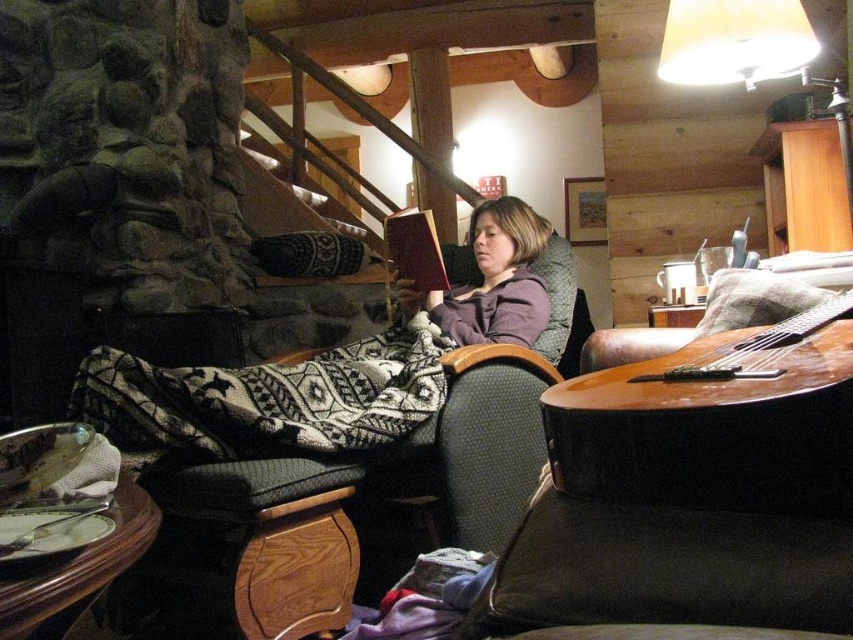
Between knitted wool blanket at center and dark brown wooden stool at lower left, which one is positioned higher?

Positioned higher is knitted wool blanket at center.

Is knitted wool blanket at center further to camera compared to dark brown wooden stool at lower left?

Yes, it is behind dark brown wooden stool at lower left.

I want to click on knitted wool blanket at center, so click(267, 400).

Identify the location of soft purple sweater at center. (326, 369).

Between soft purple sweater at center and velvet-like dark brown pillow at center, which one appears on the right side from the viewer's perspective?

From the viewer's perspective, soft purple sweater at center appears more on the right side.

What do you see at coordinates (326, 369) in the screenshot? I see `soft purple sweater at center` at bounding box center [326, 369].

In order to click on soft purple sweater at center in this screenshot , I will do `click(326, 369)`.

Who is more forward, [438,360] or [337,260]?

Point [438,360]

Is point (238, 429) farther from camera compared to point (296, 275)?

No, (238, 429) is closer to viewer.

This screenshot has height=640, width=853. What do you see at coordinates (267, 400) in the screenshot?
I see `knitted wool blanket at center` at bounding box center [267, 400].

You are a GUI agent. You are given a task and a screenshot of the screen. Output one action in this format:
    pyautogui.click(x=<x>, y=<y>)
    Task: Click on the knitted wool blanket at center
    This screenshot has width=853, height=640.
    Given the screenshot: What is the action you would take?
    pyautogui.click(x=267, y=400)